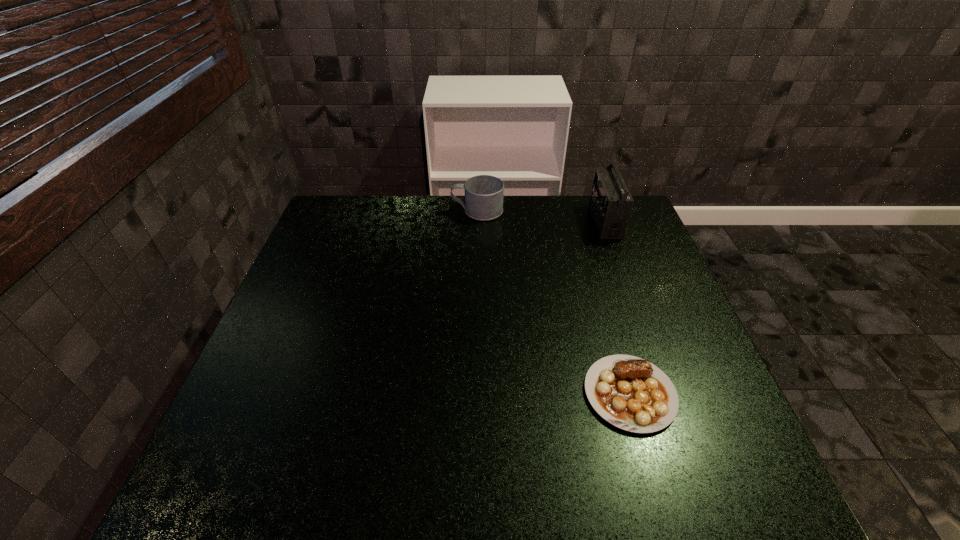
Find the location of a particular element. Image resolution: width=960 pixels, height=540 pixels. vacant area in the image that satisfies the following two spatial constraints: 1. on the side of the nearest object with the handle; 2. on the right side of the mug is located at coordinates (476, 394).